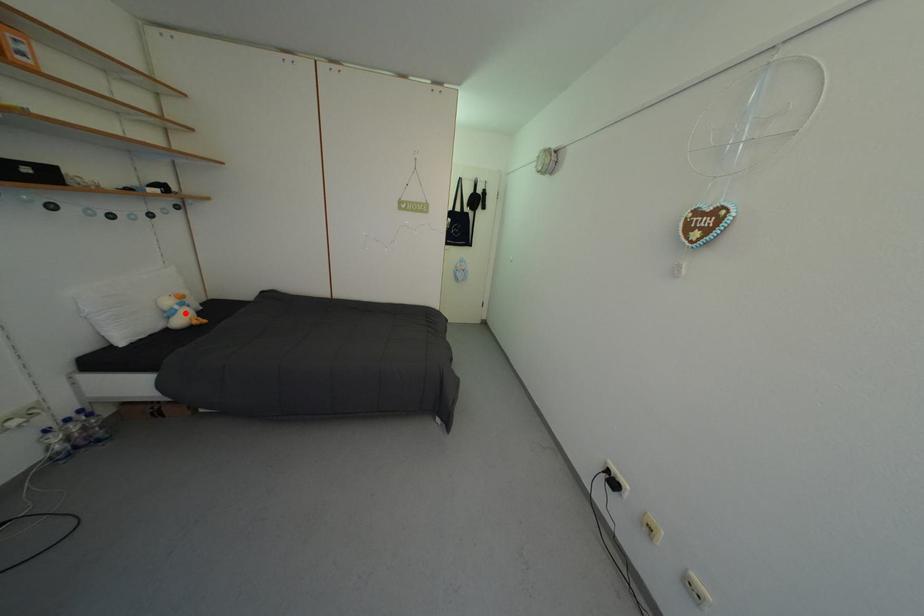
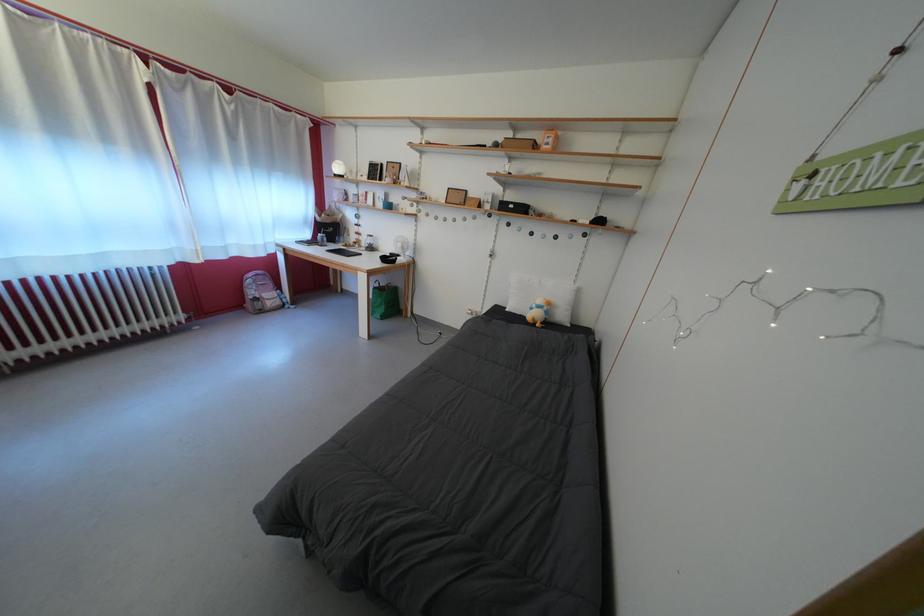
Question: I am providing you with two images of the same scene from different viewpoints. A red point is shown in image1. For the corresponding object point in image2, is it positioned nearer or farther from the camera?

Choices:
 (A) Nearer
 (B) Farther

Answer: (B)